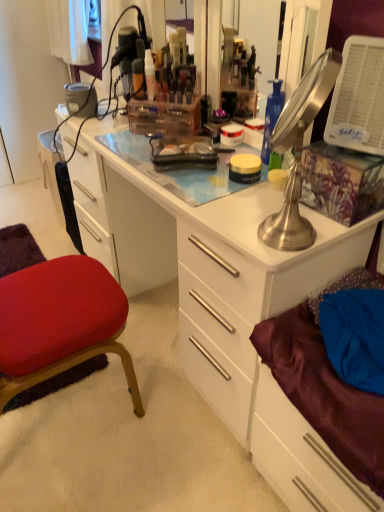
Locate an element on the screen. The width and height of the screenshot is (384, 512). vacant area situated to the left side of metallic silver lamp at upper right is located at coordinates (230, 229).